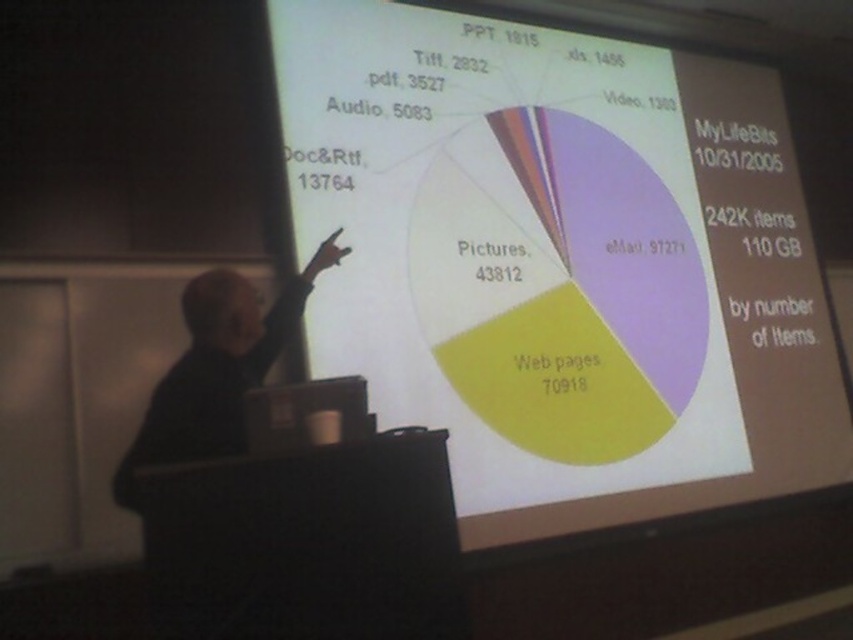
Does white paper at center appear over black fabric at left?

Yes.

Is point (618, 196) less distant than point (160, 396)?

That is False.

Identify the location of white paper at center. (560, 262).